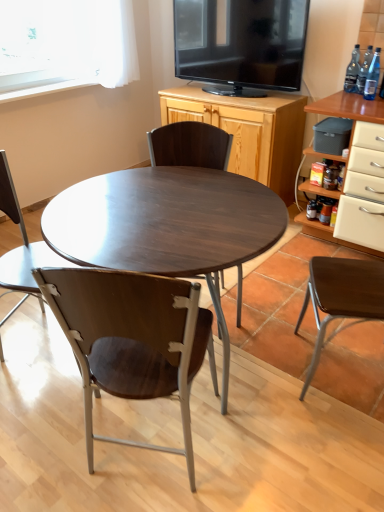
Identify the location of vacant area that lies between brown wood chair at right, arranged as the 1th chair when viewed from the right, and dark wood/finish coffee table at center. (284, 396).